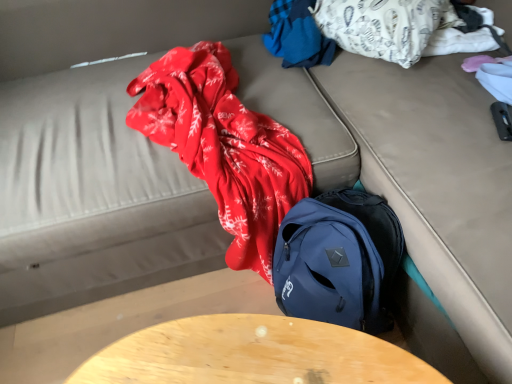
Question: Relative to blue fabric at upper center, which is the first clothing from left to right, is white cotton blanket at upper right, which is the 1th clothing in right-to-left order, in front or behind?

Choices:
 (A) front
 (B) behind

Answer: (A)

Question: Is white cotton blanket at upper right, which is the 1th clothing in right-to-left order, wider or thinner than blue fabric at upper center, arranged as the 2th clothing when viewed from the right?

Choices:
 (A) wide
 (B) thin

Answer: (A)

Question: Which object is the closest to the wooden table at center?

Choices:
 (A) white cotton blanket at upper right, the second clothing when ordered from left to right
 (B) blue fabric at upper center, arranged as the 2th clothing when viewed from the right

Answer: (B)

Question: Which is farther from the blue fabric at upper center, which is the first clothing from left to right?

Choices:
 (A) white cotton blanket at upper right, which is the 1th clothing in right-to-left order
 (B) wooden table at center

Answer: (B)